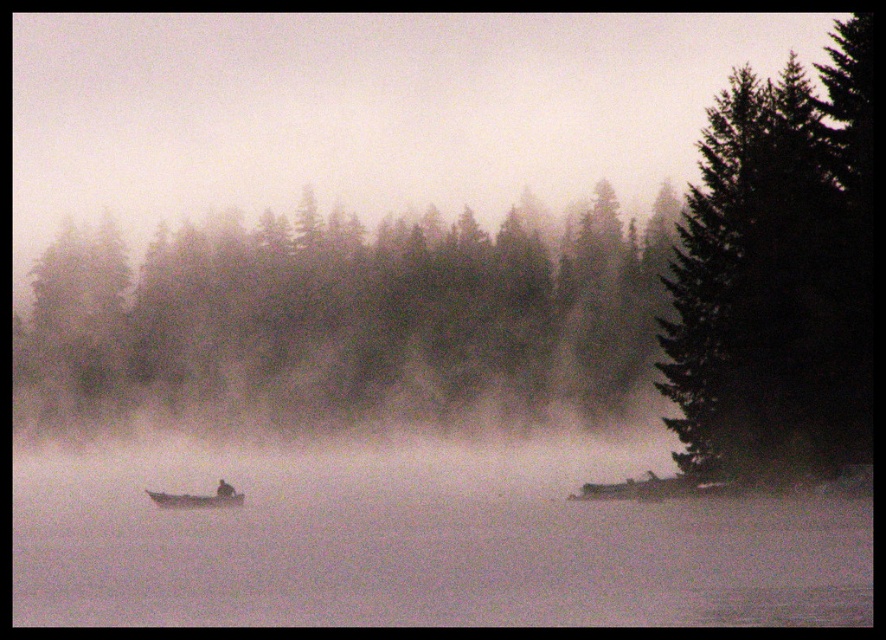
Question: Which point is closer to the camera?

Choices:
 (A) green matte trees at center
 (B) dark green textured tree at right
 (C) wooden boat at center

Answer: (B)

Question: Can you confirm if green matte trees at center is wider than dark green textured tree at right?

Choices:
 (A) yes
 (B) no

Answer: (A)

Question: Is green matte trees at center wider than dark green textured tree at right?

Choices:
 (A) yes
 (B) no

Answer: (A)

Question: Among these points, which one is farthest from the camera?

Choices:
 (A) (519, 404)
 (B) (768, 177)

Answer: (A)

Question: Which of the following is the closest to the observer?

Choices:
 (A) (122, 252)
 (B) (165, 497)

Answer: (B)

Question: Can you confirm if dark green textured tree at right is wider than wooden boat at center?

Choices:
 (A) yes
 (B) no

Answer: (A)